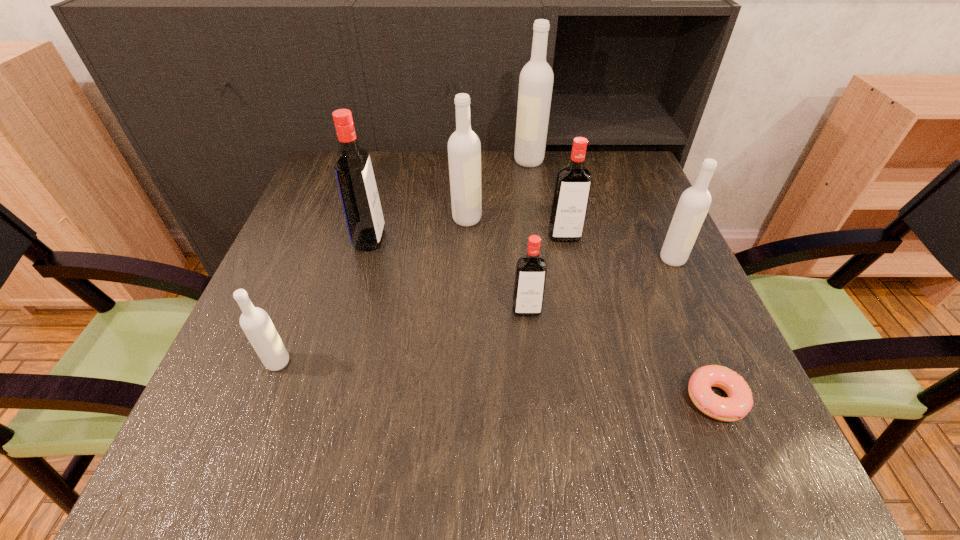
Find the location of a particular element. The image size is (960, 540). empty location between the biggest white vodka and the nearest red vodka is located at coordinates (528, 235).

The height and width of the screenshot is (540, 960). What are the coordinates of `empty space between the fifth vodka from right to left and the biggest red vodka` in the screenshot? It's located at (419, 229).

Find the location of a particular element. This screenshot has height=540, width=960. empty space between the third nearest object and the second nearest white vodka is located at coordinates (600, 285).

Image resolution: width=960 pixels, height=540 pixels. Find the location of `free space between the shortest object and the smallest red vodka`. free space between the shortest object and the smallest red vodka is located at coordinates (621, 354).

This screenshot has width=960, height=540. Identify the location of free space between the leftmost object and the second vodka from left to right. (324, 301).

This screenshot has height=540, width=960. What are the coordinates of `vacant point located between the leftmost white vodka and the second nearest vodka` in the screenshot? It's located at pyautogui.click(x=402, y=336).

The width and height of the screenshot is (960, 540). What are the coordinates of `free point between the second red vodka from right to left and the nearest white vodka` in the screenshot? It's located at (402, 336).

The width and height of the screenshot is (960, 540). Find the location of `vacant space that is in between the second smallest red vodka and the tallest vodka`. vacant space that is in between the second smallest red vodka and the tallest vodka is located at coordinates (547, 199).

Locate an element on the screen. This screenshot has width=960, height=540. vacant area between the doughnut and the third biggest white vodka is located at coordinates (694, 329).

Where is `object that stands as the fourth closest to the third white vodka from right to left`? This screenshot has height=540, width=960. object that stands as the fourth closest to the third white vodka from right to left is located at coordinates (531, 269).